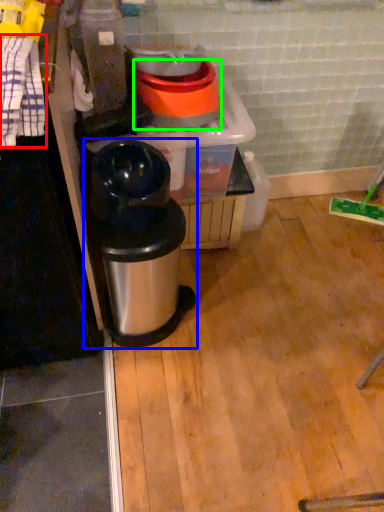
Question: Considering the real-world distances, which object is closest to laundry (highlighted by a red box)? waste container (highlighted by a blue box) or appliance (highlighted by a green box).

Choices:
 (A) waste container
 (B) appliance

Answer: (A)